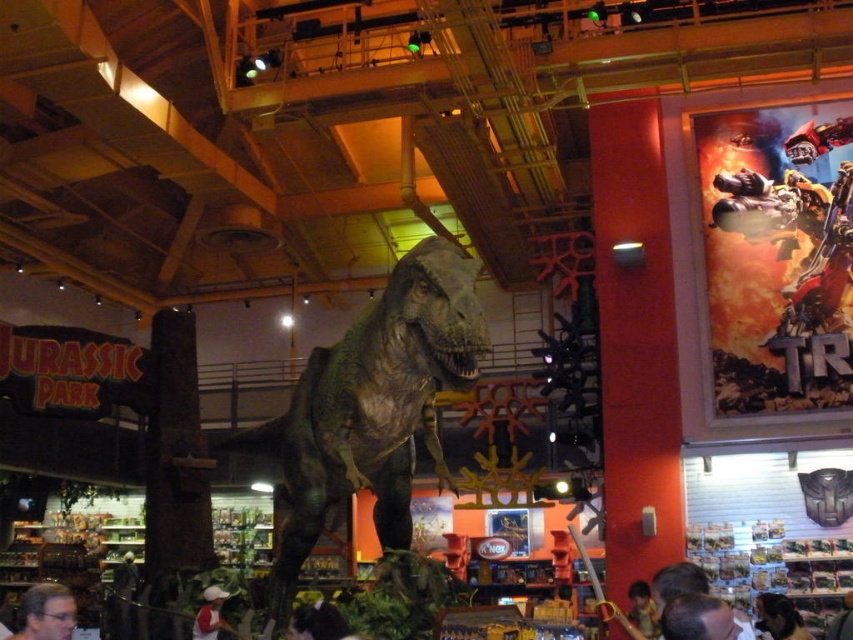
Does point (682, 618) come in front of point (49, 627)?

Yes.

In the scene shown: Does smooth brown hair at lower center have a greater height compared to matte black hair at lower left?

Correct, smooth brown hair at lower center is much taller as matte black hair at lower left.

Measure the distance between point (722, 612) and camera.

3.99 meters

I want to click on smooth brown hair at lower center, so click(698, 618).

Can you confirm if green textured dinosaur at center is taller than dark brown hair at lower right?

Yes, green textured dinosaur at center is taller than dark brown hair at lower right.

Does green textured dinosaur at center come behind dark brown hair at lower right?

No, it is in front of dark brown hair at lower right.

Is point (305, 424) positioned behind point (796, 627)?

No.

This screenshot has height=640, width=853. I want to click on green textured dinosaur at center, so click(x=372, y=404).

Between green textured dinosaur at center and smooth brown hair at lower center, which one is positioned higher?

green textured dinosaur at center

Measure the distance between green textured dinosaur at center and camera.

A distance of 20.19 feet exists between green textured dinosaur at center and camera.

Between point (434, 460) and point (730, 616), which one is positioned behind?

Positioned behind is point (434, 460).

At what (x,y) coordinates should I click in order to perform the action: click on green textured dinosaur at center. Please return your answer as a coordinate pair (x, y). This screenshot has height=640, width=853. Looking at the image, I should click on (372, 404).